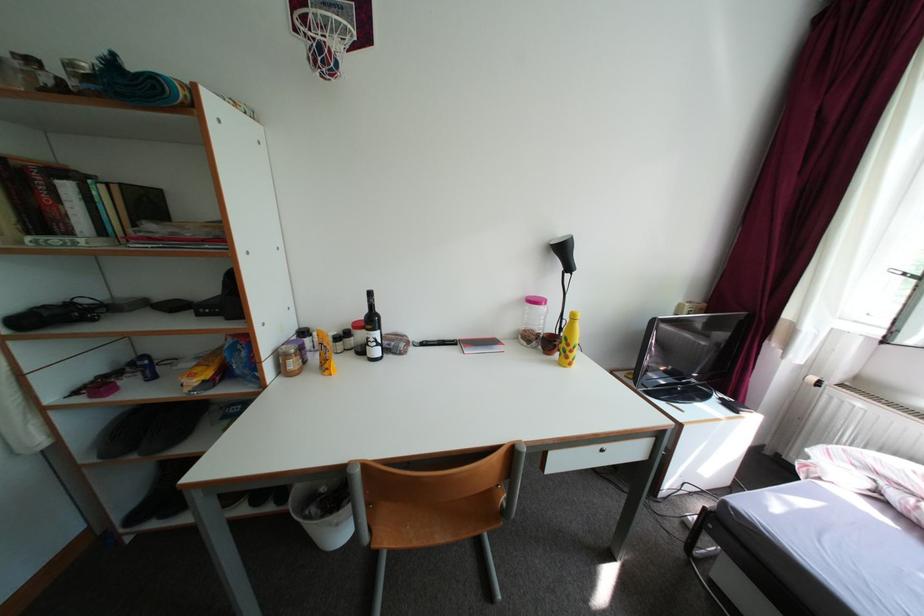
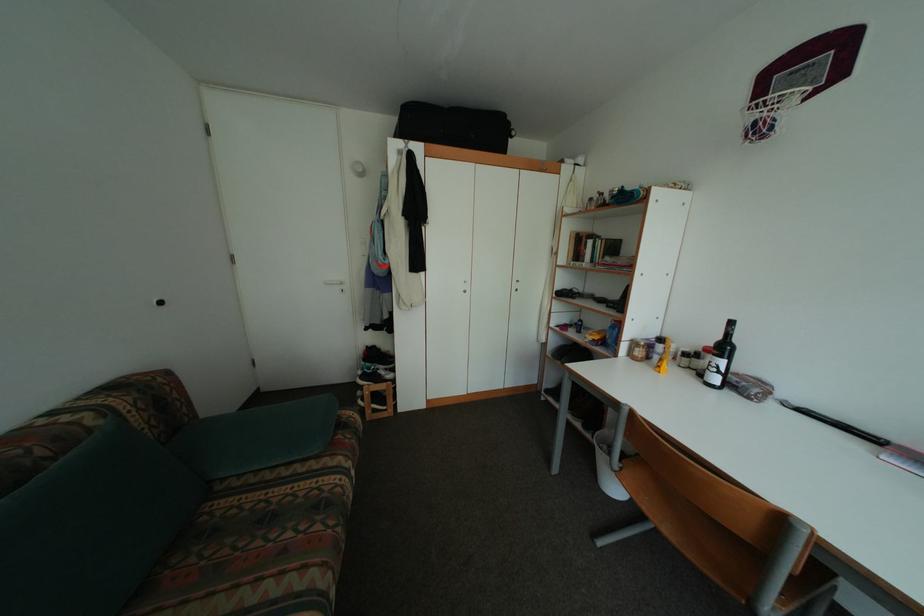
Question: The images are taken continuously from a first-person perspective. In which direction is your viewpoint rotating?

Choices:
 (A) Left
 (B) Right
 (C) Up
 (D) Down

Answer: (A)